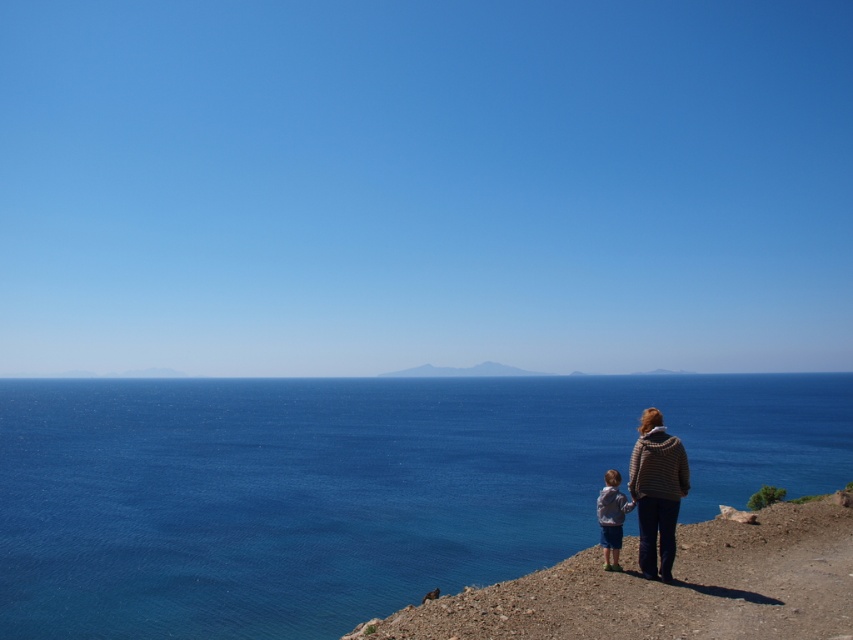
Does blue water at lower left have a greater width compared to striped sweater at right?

Yes.

Can you confirm if blue water at lower left is bigger than striped sweater at right?

Indeed, blue water at lower left has a larger size compared to striped sweater at right.

Between point (24, 520) and point (659, 470), which one is positioned behind?

The point (24, 520) is behind.

This screenshot has height=640, width=853. Identify the location of blue water at lower left. (351, 488).

Between striped sweater at right and light gray fleece jacket at lower right, which one has more height?

Standing taller between the two is light gray fleece jacket at lower right.

Who is more distant from viewer, (654, 516) or (619, 522)?

The point (619, 522) is more distant.

Is point (653, 540) closer to viewer compared to point (608, 538)?

That is True.

I want to click on striped sweater at right, so click(656, 492).

Is brown dirt at lower right bigger than striped sweater at right?

Correct, brown dirt at lower right is larger in size than striped sweater at right.

Is point (502, 614) farther from camera compared to point (662, 432)?

No, (502, 614) is in front of (662, 432).

Find the location of `brown dirt at lower right`. brown dirt at lower right is located at coordinates (666, 588).